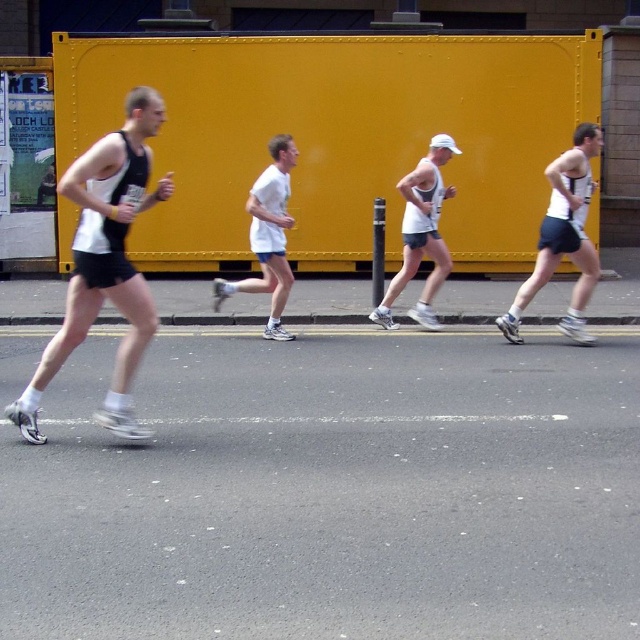
Question: Is white matte singlet at left thinner than white matte shorts at right?

Choices:
 (A) yes
 (B) no

Answer: (B)

Question: Considering the relative positions of white matte singlet at left and white matte shorts at right in the image provided, where is white matte singlet at left located with respect to white matte shorts at right?

Choices:
 (A) above
 (B) below

Answer: (B)

Question: Does white matte singlet at left have a greater width compared to white matte tank top at center?

Choices:
 (A) yes
 (B) no

Answer: (A)

Question: Which of the following is the farthest from the observer?

Choices:
 (A) (282, 284)
 (B) (440, 200)
 (C) (122, 163)
 (D) (572, 252)

Answer: (B)

Question: Which point is closer to the camera?

Choices:
 (A) white matte shorts at right
 (B) white matte shirt at center
 (C) white matte singlet at left
 (D) white matte tank top at center

Answer: (C)

Question: Based on their relative distances, which object is farther from the white matte tank top at center?

Choices:
 (A) white matte singlet at left
 (B) white matte shirt at center

Answer: (A)